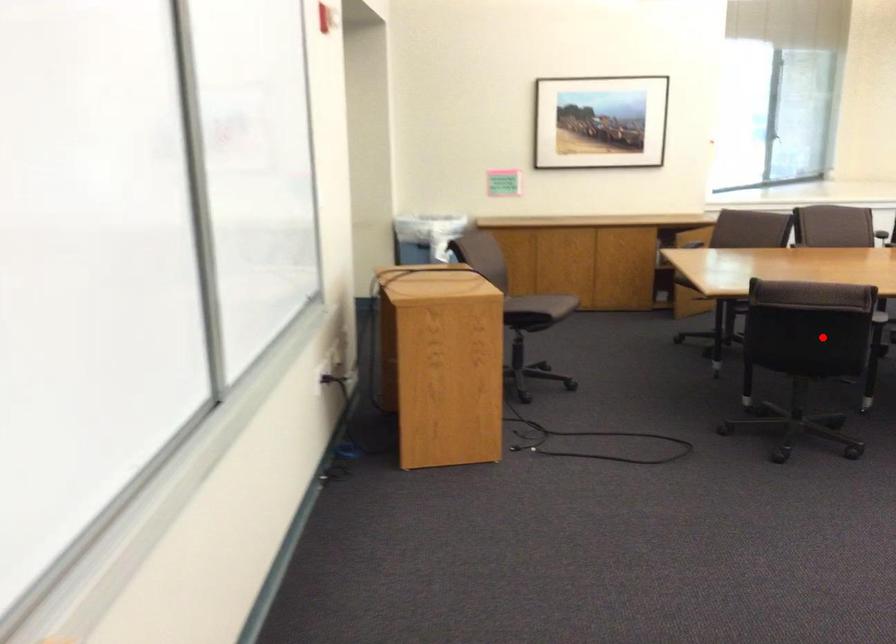
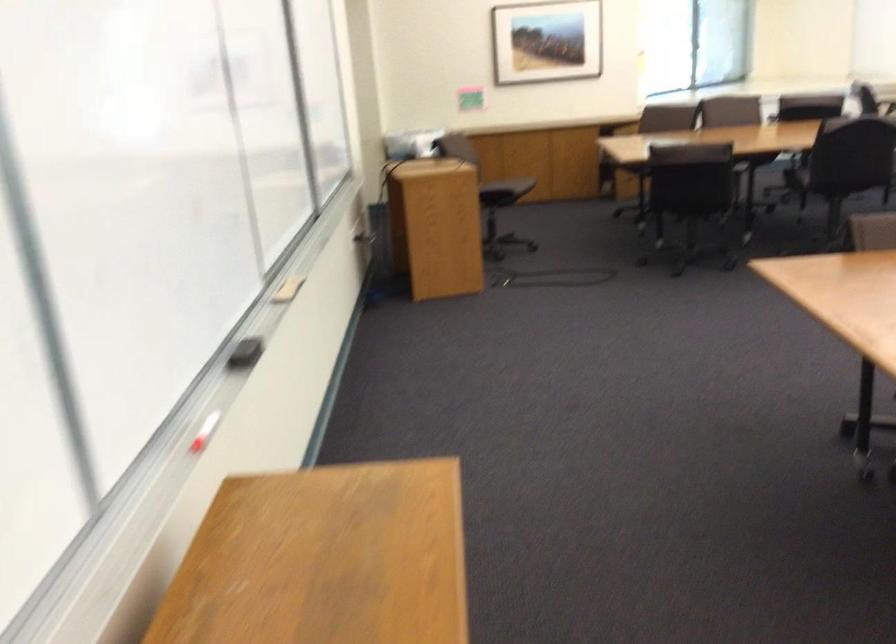
Question: I am providing you with two images of the same scene from different viewpoints. Image1 has a red point marked. In image2, the corresponding 3D location appears at what relative position? Reply with the corresponding letter.

Choices:
 (A) Closer
 (B) Farther

Answer: (B)